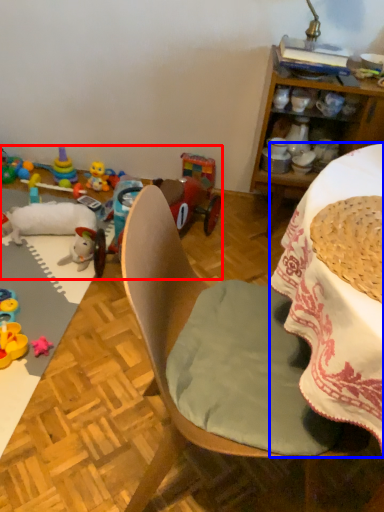
Question: Which point is further to the camera, toy (highlighted by a red box) or desk (highlighted by a blue box)?

Choices:
 (A) toy
 (B) desk

Answer: (A)